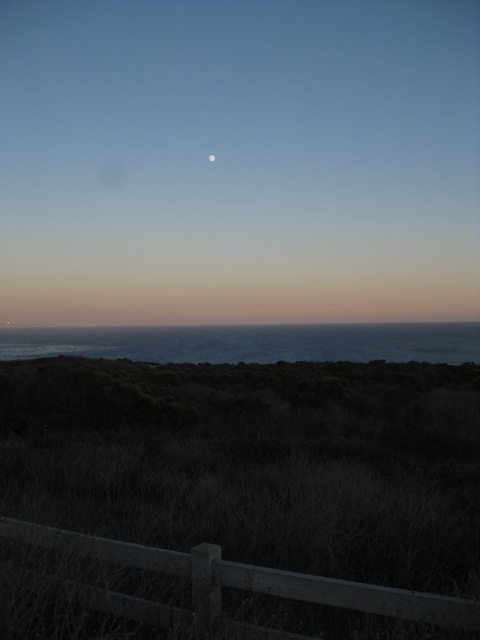
Question: Among these points, which one is nearest to the camera?

Choices:
 (A) (361, 337)
 (B) (213, 156)
 (C) (414, 266)

Answer: (A)

Question: Can you confirm if blue water at center is positioned to the left of brown wooden fence at lower center?

Choices:
 (A) yes
 (B) no

Answer: (B)

Question: Does brown wooden fence at lower center come behind white matte moon at upper center?

Choices:
 (A) yes
 (B) no

Answer: (B)

Question: Among these objects, which one is nearest to the camera?

Choices:
 (A) matte blue sky at upper center
 (B) blue water at center
 (C) brown wooden fence at lower center

Answer: (C)

Question: Estimate the real-world distances between objects in this image. Which object is farther from the brown wooden fence at lower center?

Choices:
 (A) blue water at center
 (B) matte blue sky at upper center
 (C) white matte moon at upper center

Answer: (B)

Question: Does blue water at center have a lesser width compared to brown wooden fence at lower center?

Choices:
 (A) yes
 (B) no

Answer: (B)